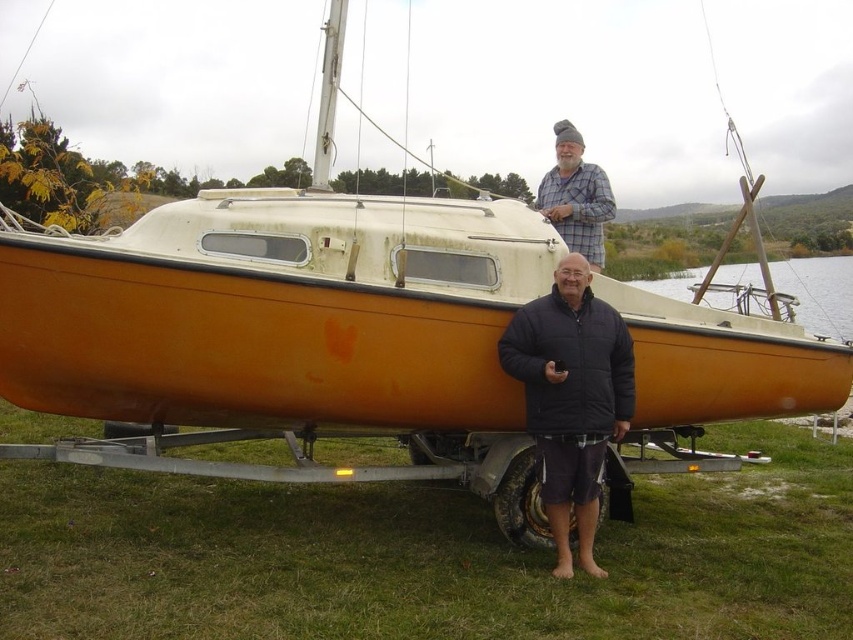
Question: Which point is closer to the camera?

Choices:
 (A) plaid fabric shirt at upper center
 (B) black fuzzy jacket at center

Answer: (B)

Question: Which point is farther to the camera?

Choices:
 (A) (520, 321)
 (B) (579, 193)

Answer: (B)

Question: Considering the relative positions of black fuzzy jacket at center and plaid fabric shirt at upper center in the image provided, where is black fuzzy jacket at center located with respect to plaid fabric shirt at upper center?

Choices:
 (A) below
 (B) above

Answer: (A)

Question: Does black fuzzy jacket at center have a larger size compared to plaid fabric shirt at upper center?

Choices:
 (A) yes
 (B) no

Answer: (B)

Question: Which point is farther to the camera?

Choices:
 (A) (543, 426)
 (B) (554, 193)

Answer: (B)

Question: Is black fuzzy jacket at center to the left of plaid fabric shirt at upper center from the viewer's perspective?

Choices:
 (A) no
 (B) yes

Answer: (B)